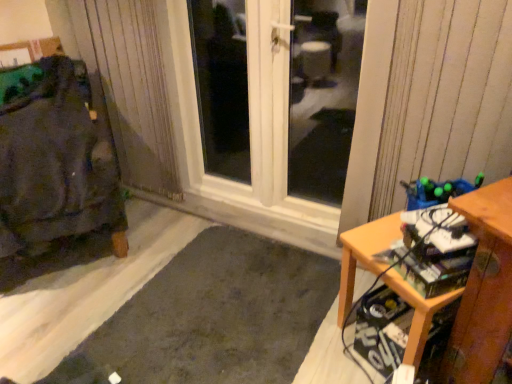
Image resolution: width=512 pixels, height=384 pixels. In order to click on wooden desk at lower right in this screenshot , I will do `click(472, 293)`.

The width and height of the screenshot is (512, 384). Describe the element at coordinates (472, 293) in the screenshot. I see `wooden desk at lower right` at that location.

You are a GUI agent. You are given a task and a screenshot of the screen. Output one action in this format:
    pyautogui.click(x=<x>, y=<y>)
    Task: Click on the white plastic window at center
    
    Given the screenshot: What is the action you would take?
    pyautogui.click(x=322, y=94)

What do you see at coordinates (323, 95) in the screenshot? This screenshot has height=384, width=512. I see `transparent glass door at center` at bounding box center [323, 95].

Image resolution: width=512 pixels, height=384 pixels. I want to click on wooden desk at lower right, so click(x=472, y=293).

Is wooden desk at lower right next to transparent glass door at center and touching it?

No, wooden desk at lower right is not making contact with transparent glass door at center.

From the picture: Who is taller, wooden desk at lower right or transparent glass door at center?

transparent glass door at center is taller.

Is transparent glass door at center at the back of wooden desk at lower right?

wooden desk at lower right does not have its back to transparent glass door at center.

From a real-world perspective, between wooden desk at lower right and transparent glass door at center, who is vertically higher?

transparent glass door at center.

The image size is (512, 384). I want to click on doormat lying on the left of white plastic window at center, so click(213, 317).

From the image's perspective, relative to dark gray carpet at lower left, is white plastic window at center above or below?

Based on their image positions, white plastic window at center is located above dark gray carpet at lower left.

Is white plastic window at center taller or shorter than dark gray carpet at lower left?

white plastic window at center is taller than dark gray carpet at lower left.

From the picture: Is wooden desk at lower right to the left or to the right of dark gray fabric at left in the image?

wooden desk at lower right is positioned on dark gray fabric at left's right side.

Is dark gray fabric at left inside wooden desk at lower right?

No, dark gray fabric at left is not inside wooden desk at lower right.

Considering the positions of point (476, 279) and point (108, 213), is point (476, 279) closer or farther from the camera than point (108, 213)?

Point (476, 279) is positioned closer to the camera compared to point (108, 213).

What's the angular difference between wooden desk at lower right and dark gray fabric at left's facing directions?

The facing directions of wooden desk at lower right and dark gray fabric at left are 87 degrees apart.

Which is in front, point (20, 138) or point (325, 84)?

The point (20, 138) is in front.

Locate an element on the screen. This screenshot has height=384, width=512. window on the right of dark gray fabric at left is located at coordinates (322, 94).

From a real-world perspective, does dark gray fabric at left sit lower than white plastic window at center?

Yes, from a real-world perspective, dark gray fabric at left is below white plastic window at center.

Could you tell me if dark gray fabric at left is turned towards white plastic window at center?

No, dark gray fabric at left is not turned towards white plastic window at center.

Is wooden desk at lower right wider or thinner than white plastic window at center?

Clearly, wooden desk at lower right has more width compared to white plastic window at center.

From the image's perspective, is wooden desk at lower right over white plastic window at center?

No, from the image's perspective, wooden desk at lower right is not on top of white plastic window at center.

Is wooden desk at lower right spatially inside white plastic window at center, or outside of it?

wooden desk at lower right is spatially situated outside white plastic window at center.

Which object is positioned more to the left, white plastic window at center or dark gray fabric at left?

dark gray fabric at left is more to the left.

Is white plastic window at center taller or shorter than dark gray fabric at left?

In the image, white plastic window at center appears to be taller than dark gray fabric at left.

Is white plastic window at center oriented towards dark gray fabric at left?

Yes.

From a real-world perspective, is dark gray fabric at left physically located above or below wooden desk at lower right?

Clearly, from a real-world perspective, dark gray fabric at left is above wooden desk at lower right.

Looking at the image, does dark gray fabric at left seem bigger or smaller compared to wooden desk at lower right?

Clearly, dark gray fabric at left is larger in size than wooden desk at lower right.

Where is `desk on the right of transparent glass door at center`? The image size is (512, 384). desk on the right of transparent glass door at center is located at coordinates (472, 293).

The width and height of the screenshot is (512, 384). What are the coordinates of `window behind the dark gray carpet at lower left` in the screenshot? It's located at (322, 94).

Which object lies nearer to the anchor point white plastic window at center, wooden desk at lower right or dark gray fabric at left?

Based on the image, dark gray fabric at left appears to be nearer to white plastic window at center.

Looking at the image, which one is located closer to dark gray carpet at lower left, dark gray fabric at left or transparent glass door at center?

The object closer to dark gray carpet at lower left is dark gray fabric at left.

Based on their spatial positions, is dark gray fabric at left or wooden desk at lower right closer to white plastic window at center?

dark gray fabric at left is positioned closer to the anchor white plastic window at center.

Based on their spatial positions, is transparent glass door at center or wooden desk at lower right closer to dark gray fabric at left?

Based on the image, wooden desk at lower right appears to be nearer to dark gray fabric at left.

From the image, which object appears to be nearer to white plastic window at center, dark gray fabric at left or transparent glass door at center?

transparent glass door at center.

When comparing their distances from wooden desk at lower right, does dark gray fabric at left or transparent glass door at center seem further?

transparent glass door at center.

Which object lies further to the anchor point dark gray carpet at lower left, transparent glass door at center or dark gray fabric at left?

transparent glass door at center lies further to dark gray carpet at lower left than the other object.

Considering their positions, is dark gray carpet at lower left positioned further to transparent glass door at center than wooden desk at lower right?

Based on the image, wooden desk at lower right appears to be further to transparent glass door at center.

Locate an element on the screen. doormat located between dark gray fabric at left and white plastic window at center in the left-right direction is located at coordinates (213, 317).

Find the location of `doormat situated between dark gray fabric at left and transparent glass door at center from left to right`. doormat situated between dark gray fabric at left and transparent glass door at center from left to right is located at coordinates pyautogui.click(x=213, y=317).

This screenshot has height=384, width=512. Find the location of `window screen between white plastic window at center and dark gray carpet at lower left from top to bottom`. window screen between white plastic window at center and dark gray carpet at lower left from top to bottom is located at coordinates (323, 95).

Image resolution: width=512 pixels, height=384 pixels. Find the location of `window screen between dark gray fabric at left and wooden desk at lower right in the horizontal direction`. window screen between dark gray fabric at left and wooden desk at lower right in the horizontal direction is located at coordinates (323, 95).